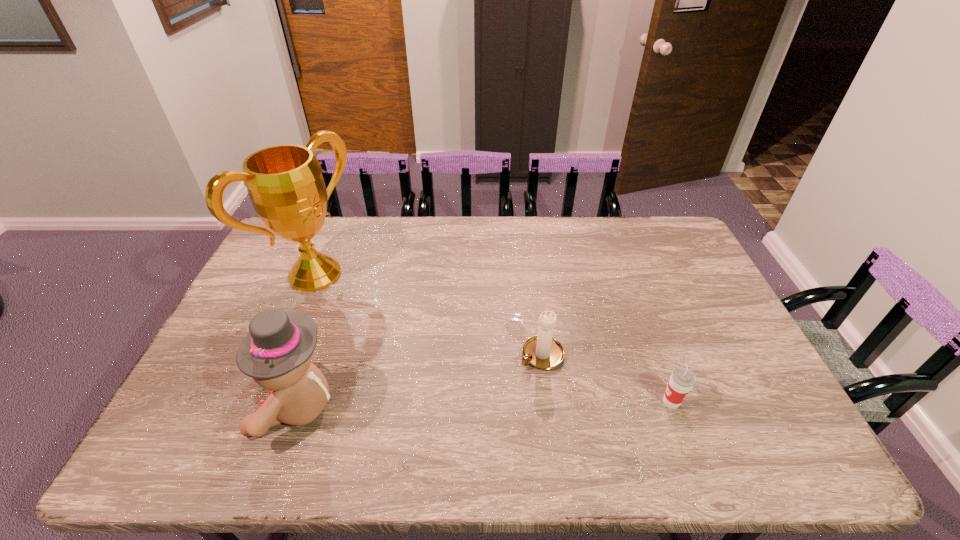
Image resolution: width=960 pixels, height=540 pixels. Find the location of `vacant position located on the side of the cup with the logo`. vacant position located on the side of the cup with the logo is located at coordinates (616, 402).

The width and height of the screenshot is (960, 540). Find the location of `vacant space located 0.190m on the side of the cup with the logo`. vacant space located 0.190m on the side of the cup with the logo is located at coordinates (585, 402).

Where is `vacant space located 0.290m on the front-facing side of the tallest object`? This screenshot has width=960, height=540. vacant space located 0.290m on the front-facing side of the tallest object is located at coordinates (408, 340).

Locate an element on the screen. vacant space located on the front-facing side of the tallest object is located at coordinates (396, 332).

This screenshot has height=540, width=960. I want to click on vacant space located 0.260m on the front-facing side of the tallest object, so click(400, 335).

This screenshot has width=960, height=540. I want to click on vacant point located on the handle side of the third object from left to right, so [481, 399].

The height and width of the screenshot is (540, 960). I want to click on vacant position located on the handle side of the third object from left to right, so click(478, 401).

Locate an element on the screen. The height and width of the screenshot is (540, 960). free spot located 0.180m on the handle side of the third object from left to right is located at coordinates (474, 403).

At what (x,y) coordinates should I click in order to perform the action: click on object located at the far edge. Please return your answer as a coordinate pair (x, y). Looking at the image, I should click on (285, 184).

I want to click on rag_doll that is at the near edge, so click(277, 352).